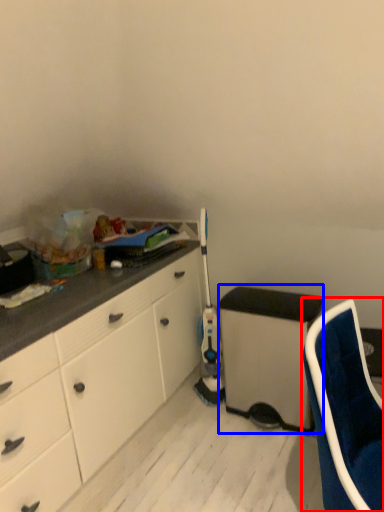
Question: Which object appears farthest to the camera in this image, chair (highlighted by a red box) or appliance (highlighted by a blue box)?

Choices:
 (A) chair
 (B) appliance

Answer: (B)